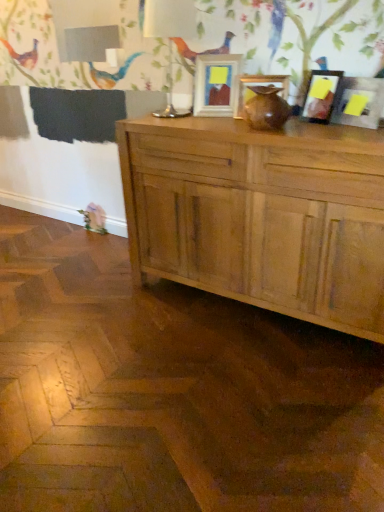
The height and width of the screenshot is (512, 384). What are the coordinates of `free location in front of white glossy table lamp at upper center` in the screenshot? It's located at (182, 120).